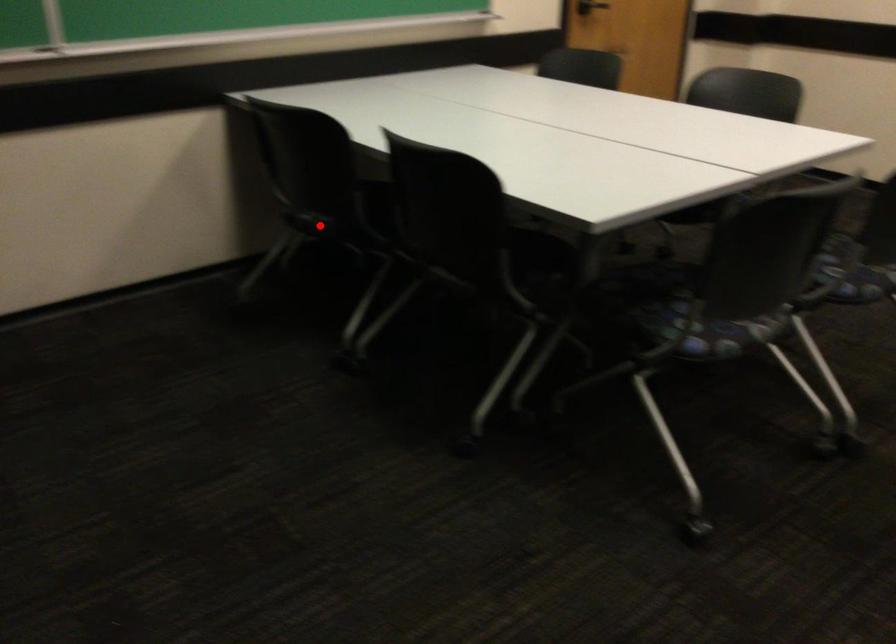
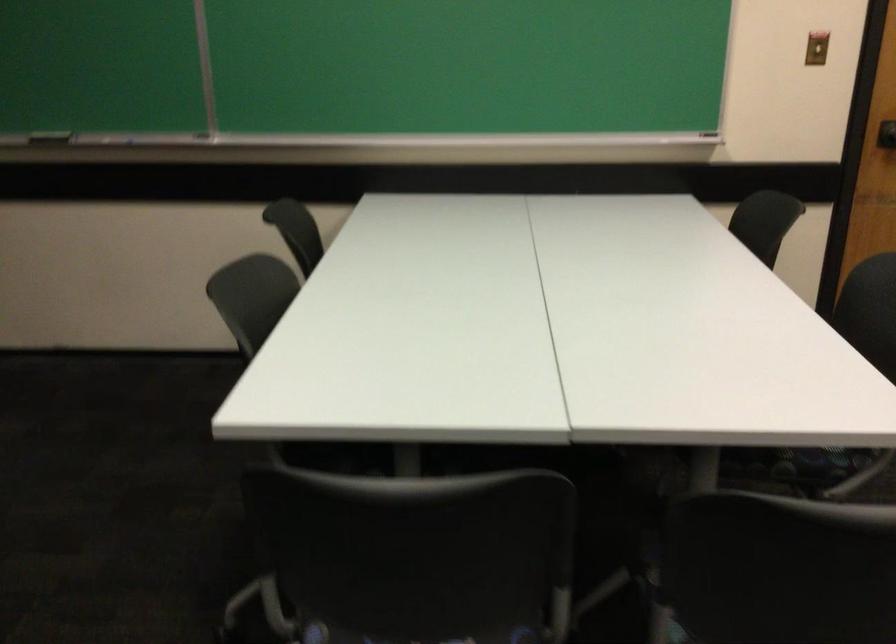
Question: I am providing you with two images of the same scene from different viewpoints. A red point is marked on the first image. Is the red point's position out of view in image 2?

Choices:
 (A) Yes
 (B) No

Answer: (A)